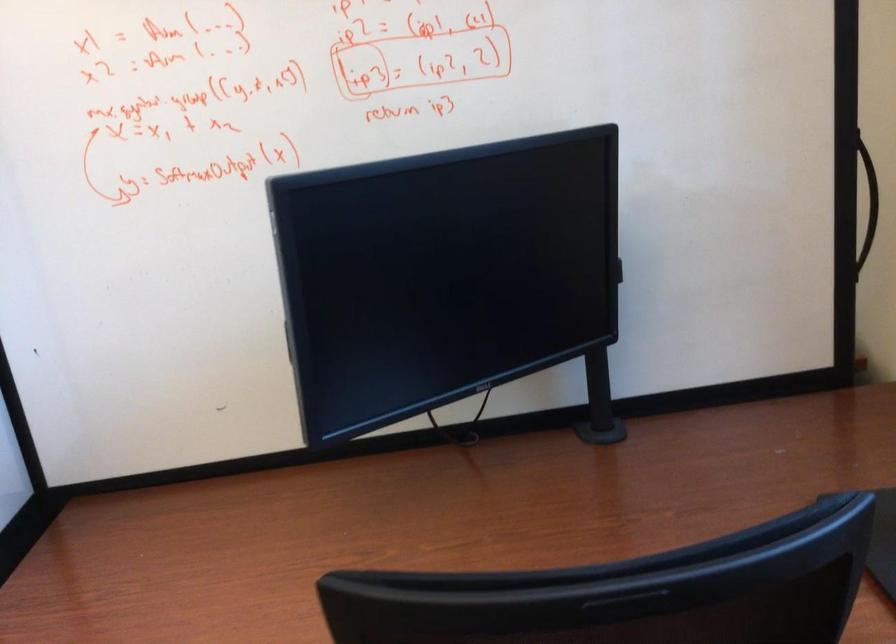
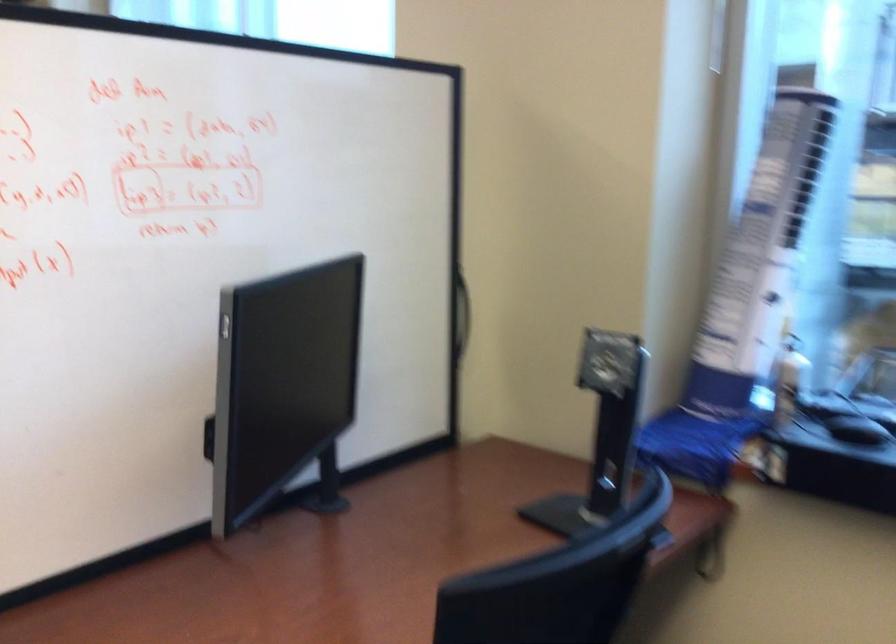
Find the pixel in the second image that matches [595,413] in the first image.

(325, 487)